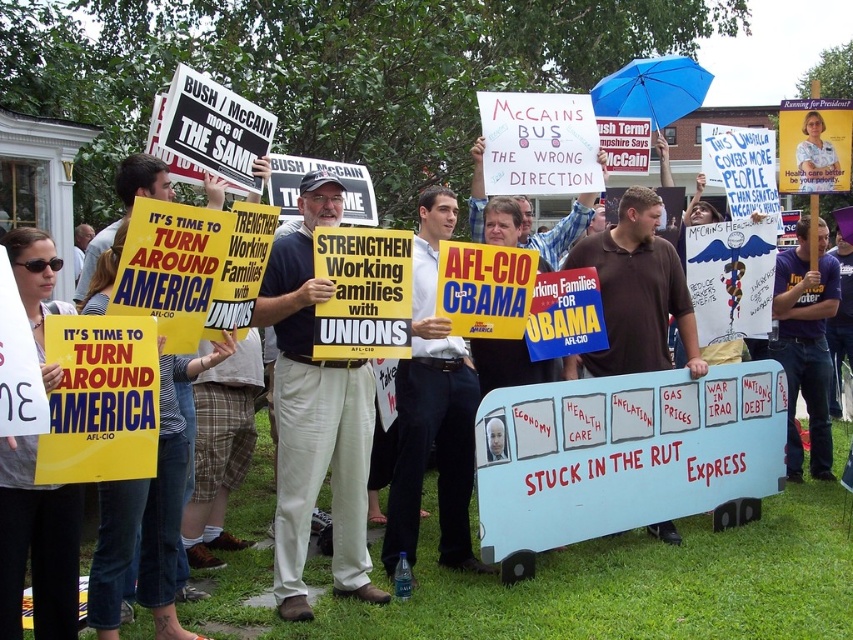
Question: Among these points, which one is nearest to the camera?

Choices:
 (A) (811, 314)
 (B) (631, 269)
 (C) (454, 541)

Answer: (C)

Question: Is the position of light beige pants at center less distant than that of white cotton shirt at center?

Choices:
 (A) yes
 (B) no

Answer: (A)

Question: Is white cotton shirt at center below brown cotton shirt at center?

Choices:
 (A) no
 (B) yes

Answer: (B)

Question: Does light beige pants at center have a larger size compared to blue fabric umbrella at upper center?

Choices:
 (A) no
 (B) yes

Answer: (A)

Question: Which of the following is the closest to the observer?

Choices:
 (A) (796, 157)
 (B) (421, 422)
 (C) (606, 76)
 (D) (335, 371)

Answer: (D)

Question: Which of these objects is positioned farthest from the light beige pants at center?

Choices:
 (A) white shirt at center
 (B) brown cotton shirt at center
 (C) purple cotton t-shirt at center

Answer: (A)